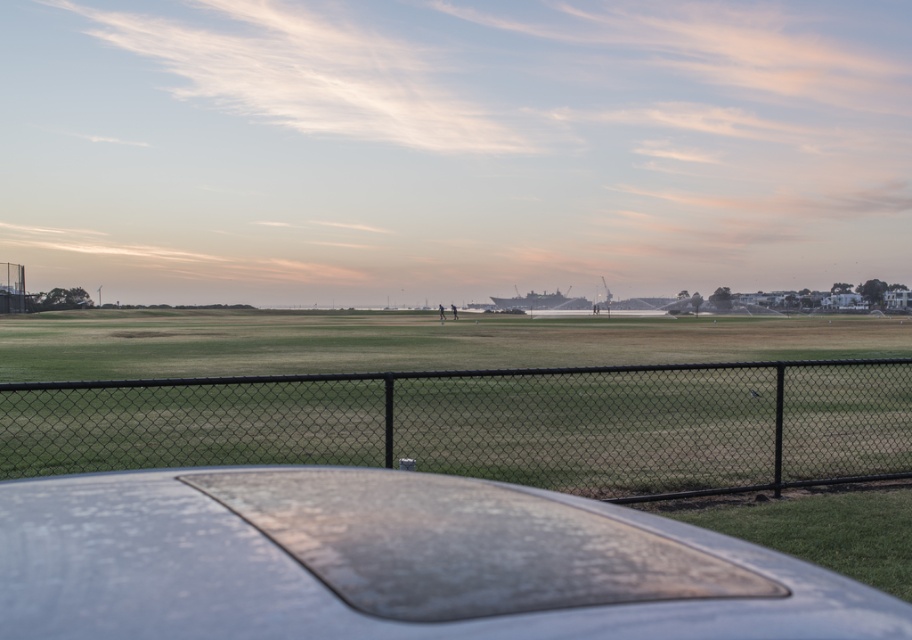
Question: Which of the following is the farthest from the observer?

Choices:
 (A) (284, 476)
 (B) (219, 435)

Answer: (B)

Question: Does matte gray car at center appear over black chain-link fence at center?

Choices:
 (A) yes
 (B) no

Answer: (A)

Question: Is matte gray car at center to the right of black chain-link fence at center from the viewer's perspective?

Choices:
 (A) yes
 (B) no

Answer: (B)

Question: Can you confirm if matte gray car at center is bigger than black chain-link fence at center?

Choices:
 (A) yes
 (B) no

Answer: (B)